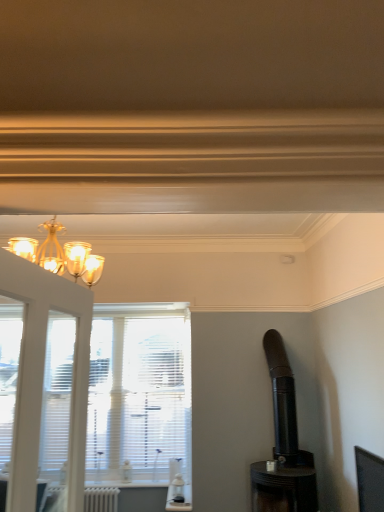
Question: Could you tell me if black matte stove at right is facing white matte radiator at lower left?

Choices:
 (A) no
 (B) yes

Answer: (A)

Question: From a real-world perspective, is black matte stove at right on white matte radiator at lower left?

Choices:
 (A) yes
 (B) no

Answer: (A)

Question: Is black matte stove at right smaller than white matte radiator at lower left?

Choices:
 (A) no
 (B) yes

Answer: (A)

Question: Is black matte stove at right taller than white matte radiator at lower left?

Choices:
 (A) yes
 (B) no

Answer: (A)

Question: From the image's perspective, would you say black matte stove at right is shown under white matte radiator at lower left?

Choices:
 (A) yes
 (B) no

Answer: (B)

Question: Is black matte stove at right wider than white matte radiator at lower left?

Choices:
 (A) no
 (B) yes

Answer: (B)

Question: From a real-world perspective, is white matte radiator at lower left located beneath black matte stove at right?

Choices:
 (A) no
 (B) yes

Answer: (B)

Question: From a real-world perspective, is white matte radiator at lower left on top of black matte stove at right?

Choices:
 (A) no
 (B) yes

Answer: (A)

Question: Does white matte radiator at lower left have a larger size compared to black matte stove at right?

Choices:
 (A) yes
 (B) no

Answer: (B)

Question: Is white matte radiator at lower left in contact with black matte stove at right?

Choices:
 (A) no
 (B) yes

Answer: (A)

Question: Considering the relative sizes of white matte radiator at lower left and black matte stove at right in the image provided, is white matte radiator at lower left taller than black matte stove at right?

Choices:
 (A) yes
 (B) no

Answer: (B)

Question: Is the position of white matte radiator at lower left more distant than that of black matte stove at right?

Choices:
 (A) no
 (B) yes

Answer: (B)

Question: In terms of width, does white matte radiator at lower left look wider or thinner when compared to black matte stove at right?

Choices:
 (A) thin
 (B) wide

Answer: (A)